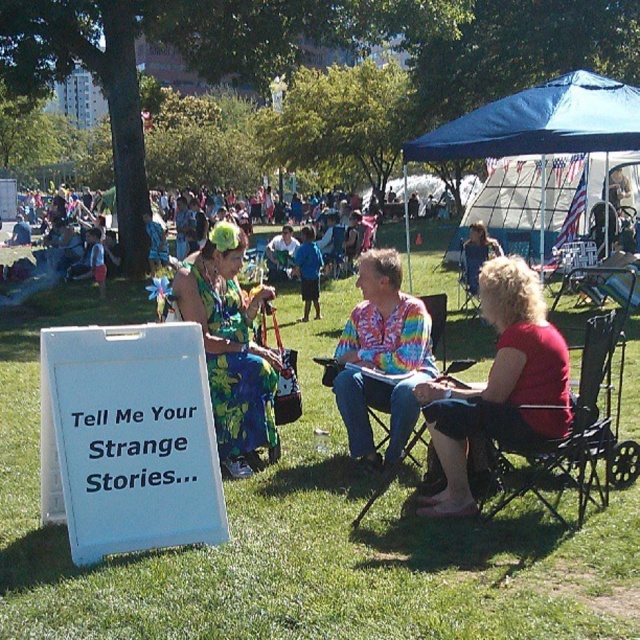
You are a photographer at the festival and want to capture both the white paper sign at lower left and the floral fabric dress at center in your photo. Since you want the sign to be more prominent, which object should you place closer to the camera?

The white paper sign at lower left has a smaller size compared to floral fabric dress at center. To make the sign more prominent, you should place the white paper sign at lower left closer to the camera so it appears larger in the photo.

You are a photographer at the festival and want to capture both the white paper sign at lower left and the blue fabric canopy at upper right in a single frame. Given their sizes, which object will appear smaller in the photo?

The white paper sign at lower left will appear smaller in the photo because it occupies less space than the blue fabric canopy at upper right according to the description.

The point at coordinate (499, 385) is located on which person in the scene? Please specify by using the exact object label from the Objects section.

The point at coordinate (499, 385) is located on the red cotton shirt at center.